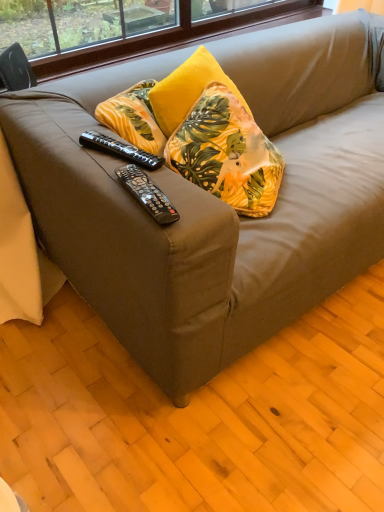
Image resolution: width=384 pixels, height=512 pixels. I want to click on free location to the right of black plastic remote control at center, marked as the first remote control in a bottom-to-top arrangement, so [195, 201].